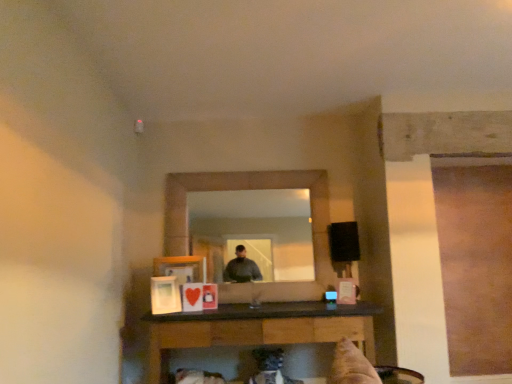
Find the location of a particular element. blank area beneath matte wooden mirror at center (from a real-world perspective) is located at coordinates (266, 300).